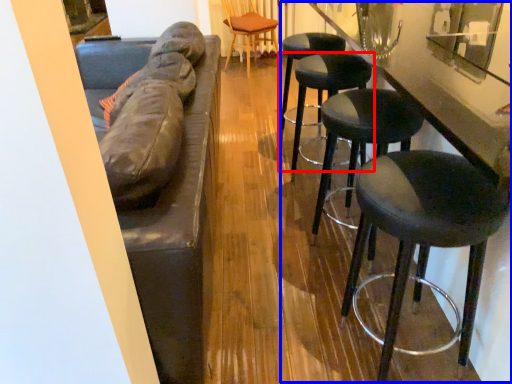
Question: Which object is closer to the camera taking this photo, stool (highlighted by a red box) or counter (highlighted by a blue box)?

Choices:
 (A) stool
 (B) counter

Answer: (B)